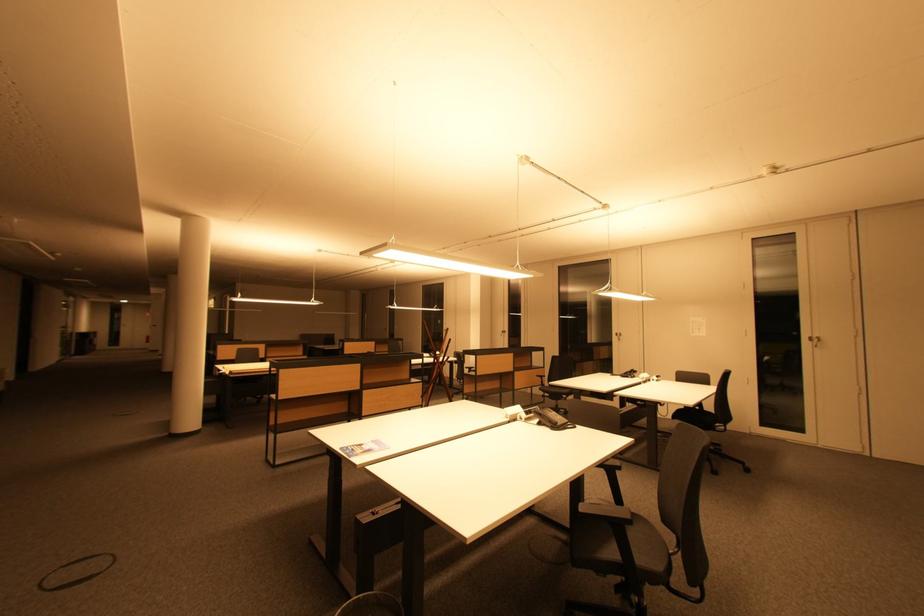
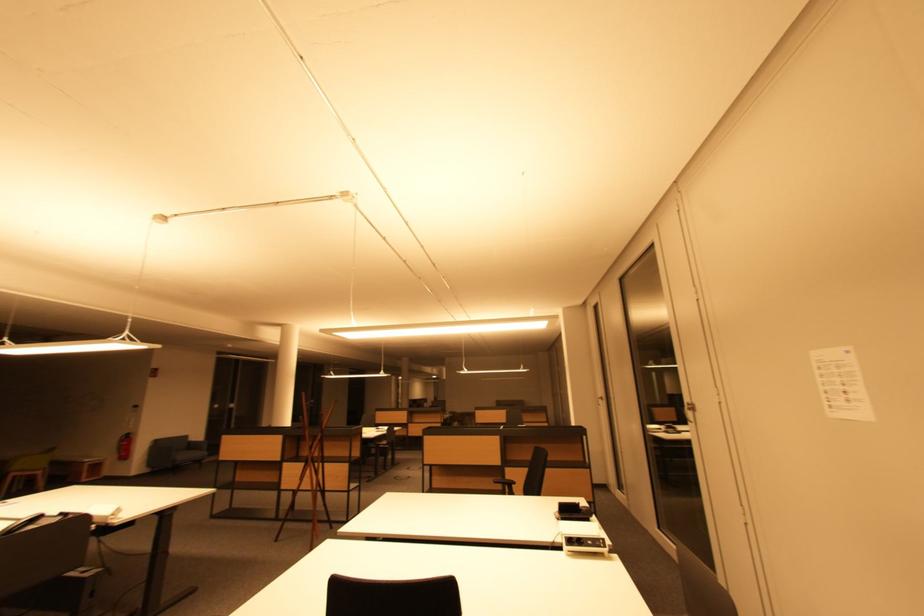
Find the pixel in the second image that matches point 507,334 in the first image.

(605, 400)